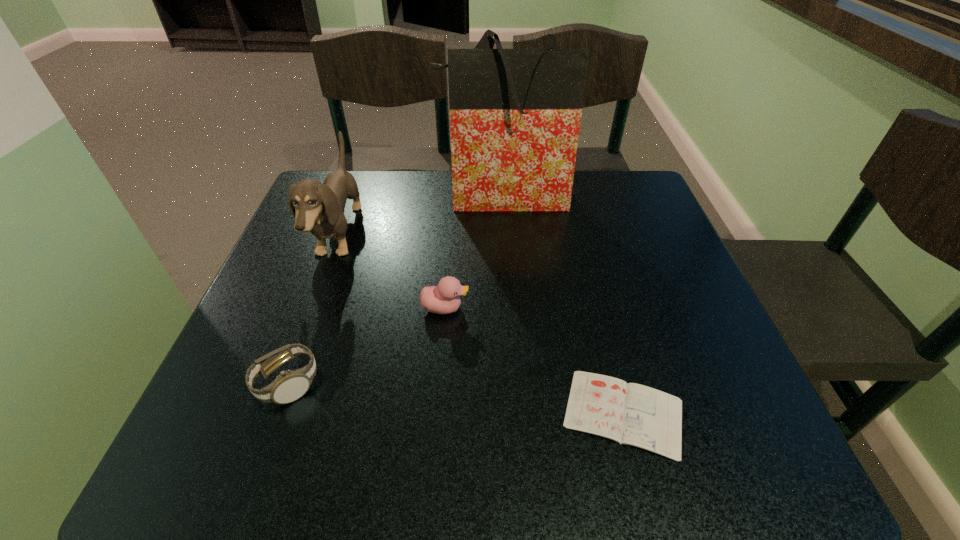
The image size is (960, 540). What are the coordinates of `shopping bag that is at the far edge` in the screenshot? It's located at (515, 114).

Identify the location of puppy situated at the far edge. Image resolution: width=960 pixels, height=540 pixels. (319, 208).

Find the location of a particular element. This screenshot has width=960, height=540. object that is at the near edge is located at coordinates (628, 413).

This screenshot has height=540, width=960. What are the coordinates of `puppy that is positioned at the left edge` in the screenshot? It's located at (319, 208).

Identify the location of watch at the left edge. This screenshot has width=960, height=540. (289, 386).

Where is `object that is at the right edge`? The width and height of the screenshot is (960, 540). object that is at the right edge is located at coordinates (628, 413).

The image size is (960, 540). Identify the location of object at the far left corner. (319, 208).

The width and height of the screenshot is (960, 540). Identify the location of object situated at the near right corner. (628, 413).

Find the location of a particular element. The width and height of the screenshot is (960, 540). vacant space at the far edge of the desktop is located at coordinates (516, 216).

In the image, there is a desktop. Where is `vacant space at the near edge`? vacant space at the near edge is located at coordinates (345, 448).